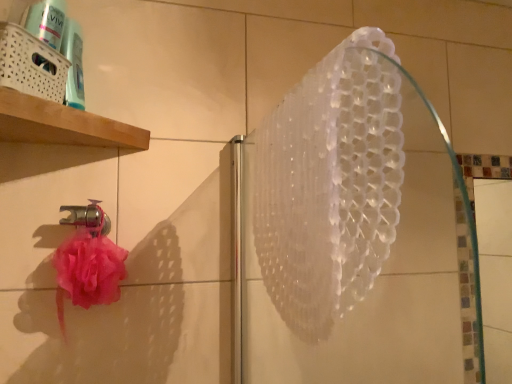
Question: Does white woven basket at upper left have a greater height compared to transparent plastic shower at upper center?

Choices:
 (A) no
 (B) yes

Answer: (A)

Question: From a real-world perspective, is white woven basket at upper left located beneath transparent plastic shower at upper center?

Choices:
 (A) no
 (B) yes

Answer: (A)

Question: Is white woven basket at upper left to the left of transparent plastic shower at upper center from the viewer's perspective?

Choices:
 (A) yes
 (B) no

Answer: (A)

Question: Considering the relative sizes of white woven basket at upper left and transparent plastic shower at upper center in the image provided, is white woven basket at upper left wider than transparent plastic shower at upper center?

Choices:
 (A) yes
 (B) no

Answer: (A)

Question: Is white woven basket at upper left not within transparent plastic shower at upper center?

Choices:
 (A) yes
 (B) no

Answer: (A)

Question: Is white woven basket at upper left oriented away from transparent plastic shower at upper center?

Choices:
 (A) yes
 (B) no

Answer: (B)

Question: Is transparent plastic shower at upper center positioned with its back to white woven basket at upper left?

Choices:
 (A) no
 (B) yes

Answer: (B)

Question: Does transparent plastic shower at upper center have a greater height compared to white woven basket at upper left?

Choices:
 (A) no
 (B) yes

Answer: (B)

Question: From the image's perspective, is transparent plastic shower at upper center on top of white woven basket at upper left?

Choices:
 (A) yes
 (B) no

Answer: (B)

Question: Does transparent plastic shower at upper center lie behind white woven basket at upper left?

Choices:
 (A) no
 (B) yes

Answer: (A)

Question: Can you confirm if transparent plastic shower at upper center is bigger than white woven basket at upper left?

Choices:
 (A) yes
 (B) no

Answer: (A)

Question: Can you confirm if transparent plastic shower at upper center is positioned to the right of white woven basket at upper left?

Choices:
 (A) yes
 (B) no

Answer: (A)

Question: Is white woven basket at upper left turned away from metallic silver faucet at lower left?

Choices:
 (A) no
 (B) yes

Answer: (A)